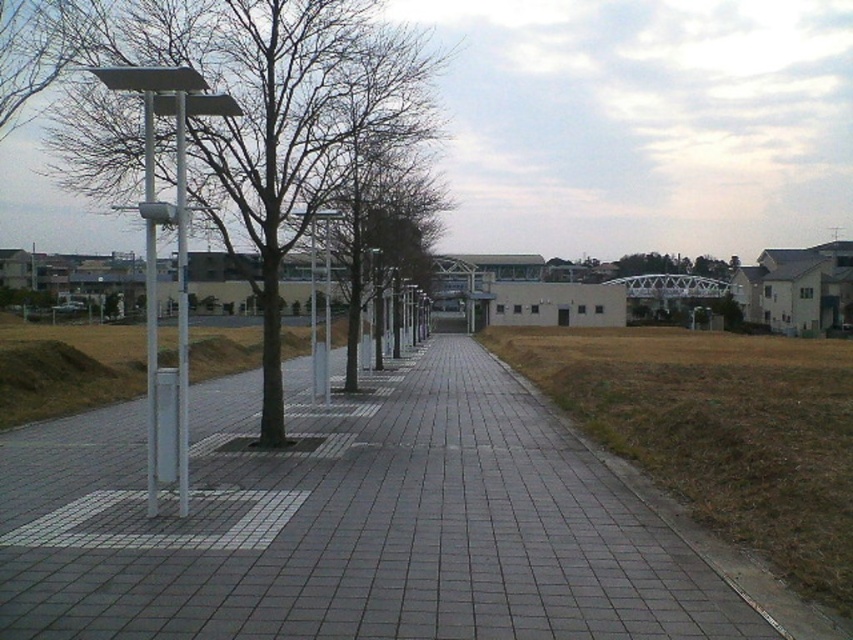
You are standing on the gray concrete pavement at center and want to walk towards the smooth gray tree at center. Which direction should you move?

The gray concrete pavement at center is to the right of the smooth gray tree at center, so you should move to the left to reach the smooth gray tree at center.

You are a landscape architect designing a new park. You need to install a new lamppost that must be taller than the existing metallic silver pole at left. Based on the scene, can the new lamppost be placed where the smooth gray tree at center is currently located without violating height restrictions?

The smooth gray tree at center has a greater height compared to metallic silver pole at left. Therefore, placing a new lamppost taller than the metallic silver pole at left at the tree location would violate height restrictions since the tree itself is already taller than the pole.